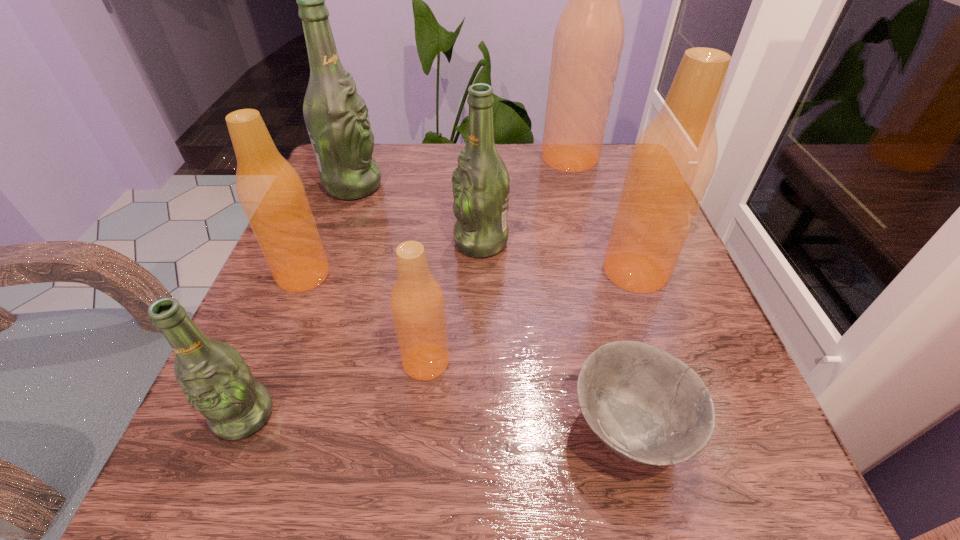
In the image, there is a desktop. At what (x,y) coordinates should I click in order to perform the action: click on vacant space at the near edge. Please return your answer as a coordinate pair (x, y). Looking at the image, I should click on (657, 507).

Identify the location of free region at the left edge. click(x=331, y=332).

Find the location of a particular element. This screenshot has height=540, width=960. vacant space at the right edge is located at coordinates (605, 209).

Locate an element on the screen. This screenshot has height=540, width=960. free point at the far left corner is located at coordinates (381, 183).

You are a GUI agent. You are given a task and a screenshot of the screen. Output one action in this format:
    pyautogui.click(x=<x>, y=<y>)
    Task: Click on the vacant space at the far right corner of the desktop
    This screenshot has width=960, height=540.
    Given the screenshot: What is the action you would take?
    pyautogui.click(x=624, y=167)

You are a GUI agent. You are given a task and a screenshot of the screen. Output one action in this format:
    pyautogui.click(x=<x>, y=<y>)
    Task: Click on the vacant space at the near right corner of the desktop
    The width and height of the screenshot is (960, 540).
    Given the screenshot: What is the action you would take?
    pyautogui.click(x=689, y=494)

Image resolution: width=960 pixels, height=540 pixels. In order to click on free point between the second biggest green beer bottle and the nearest green beer bottle in this screenshot , I will do `click(363, 329)`.

Where is `free point between the second smallest green beer bottle and the second biggest tan beer bottle`? free point between the second smallest green beer bottle and the second biggest tan beer bottle is located at coordinates [558, 257].

Where is `vacant region between the nearest green beer bottle and the biggest green beer bottle`? The height and width of the screenshot is (540, 960). vacant region between the nearest green beer bottle and the biggest green beer bottle is located at coordinates (299, 300).

The height and width of the screenshot is (540, 960). What are the coordinates of `free point between the rightmost green beer bottle and the second nearest beer bottle` in the screenshot? It's located at (453, 302).